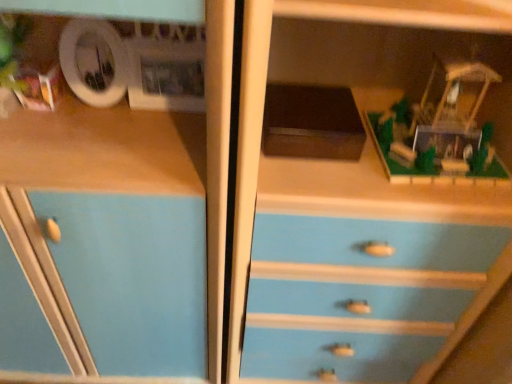
What do you see at coordinates (441, 130) in the screenshot? I see `green plastic model at upper right` at bounding box center [441, 130].

The width and height of the screenshot is (512, 384). I want to click on green plastic model at upper right, so click(x=441, y=130).

I want to click on green plastic model at upper right, so click(441, 130).